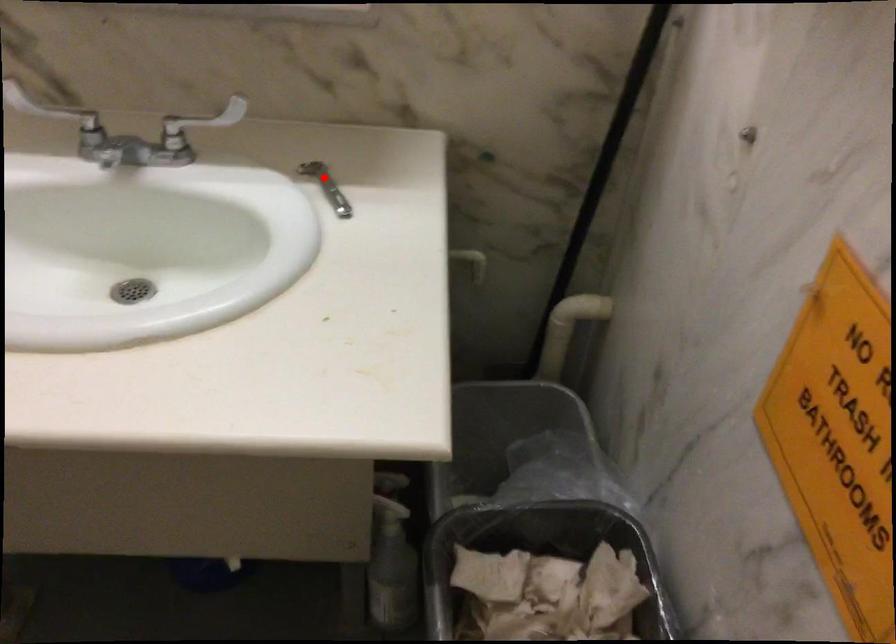
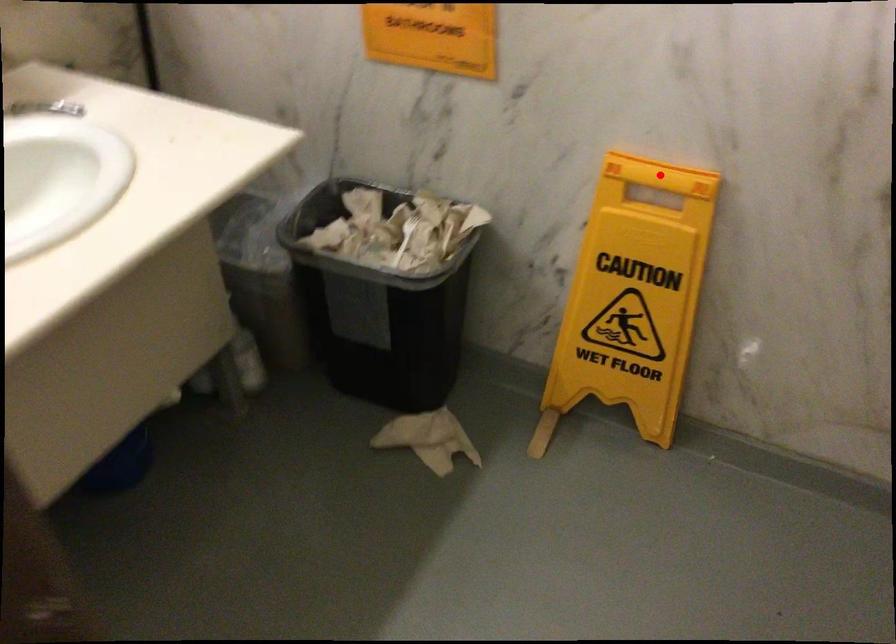
I am providing you with two images of the same scene from different viewpoints. A red point is marked on the first image and another point is marked on the second image. Is the red point in image1 aligned with the point shown in image2?

No